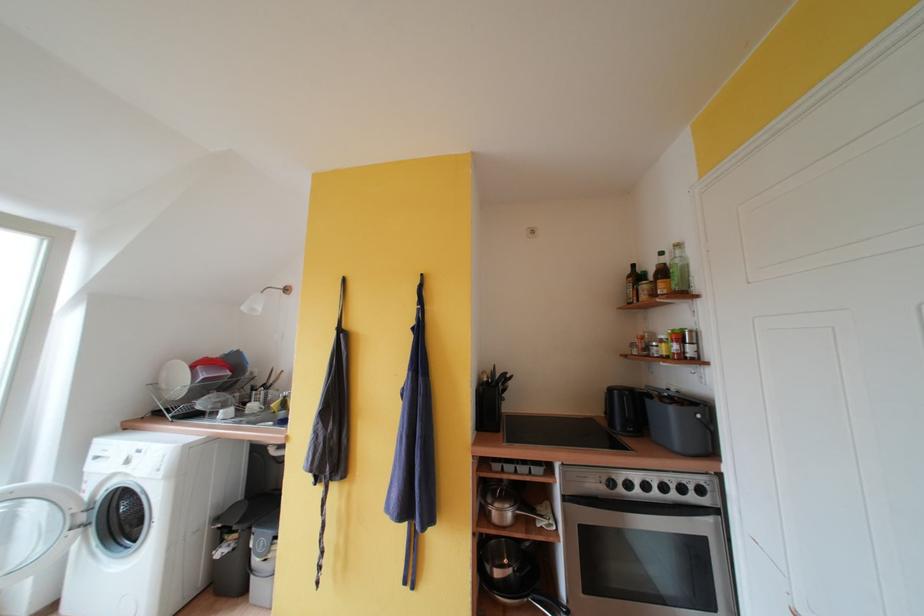
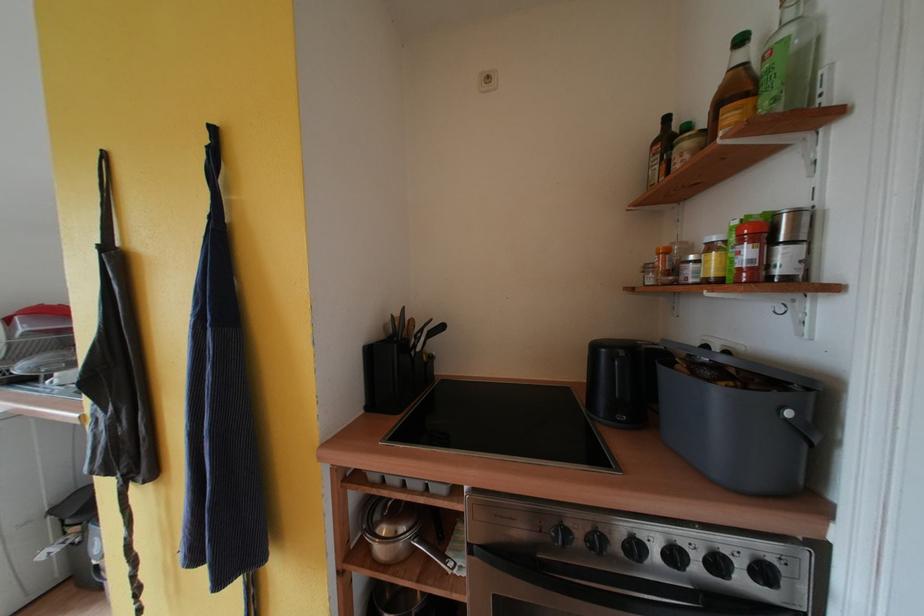
Where in the second image is the point corresponding to pixel 678 413 from the first image?

(723, 397)